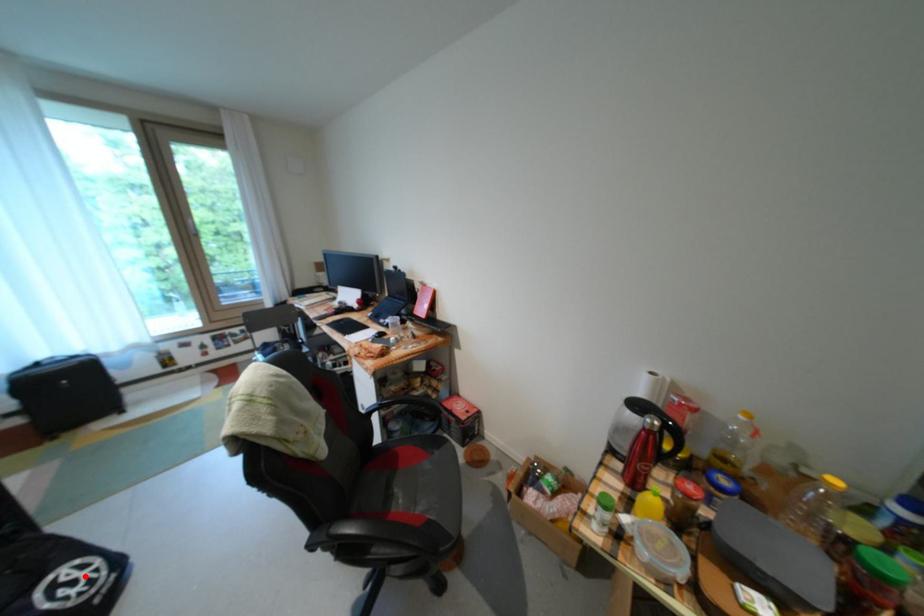
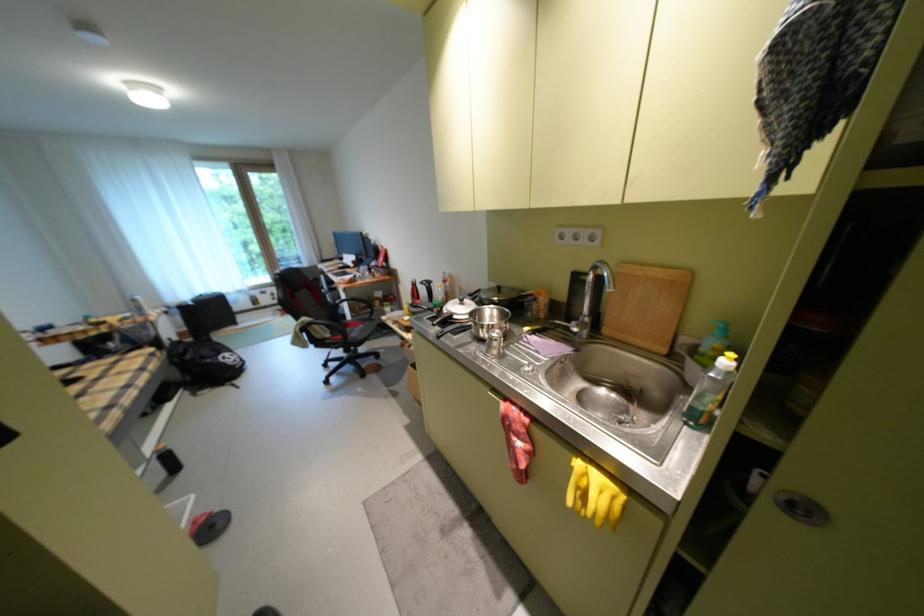
Question: I am providing you with two images of the same scene from different viewpoints. A red point is shown in image1. For the corresponding object point in image2, is it positioned nearer or farther from the camera?

Choices:
 (A) Nearer
 (B) Farther

Answer: (A)